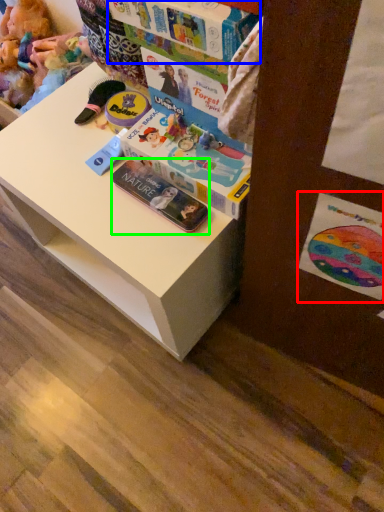
Question: Considering the real-world distances, which object is closest to postcard (highlighted by a red box)? book (highlighted by a blue box) or paperback book (highlighted by a green box).

Choices:
 (A) book
 (B) paperback book

Answer: (B)